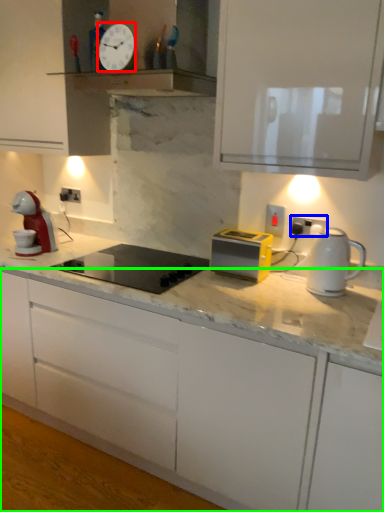
Question: Which object is the farthest from clock (highlighted by a red box)? Choose among these: electric outlet (highlighted by a blue box) or cabinetry (highlighted by a green box).

Choices:
 (A) electric outlet
 (B) cabinetry

Answer: (B)